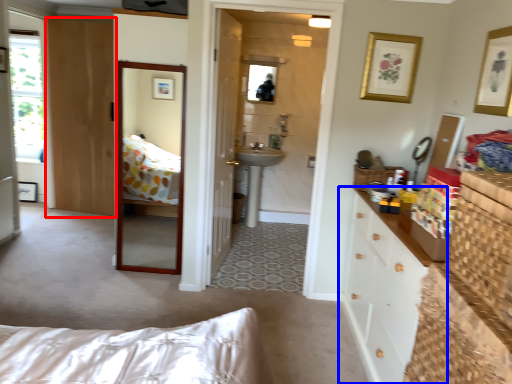
Question: Which point is closer to the camera, door (highlighted by a red box) or cabinetry (highlighted by a blue box)?

Choices:
 (A) door
 (B) cabinetry

Answer: (B)